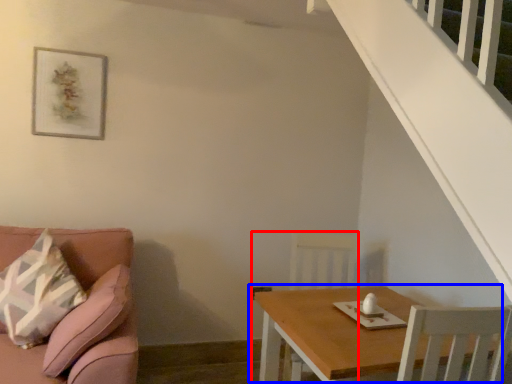
Question: Which object is closer to the camera taking this photo, armchair (highlighted by a red box) or table (highlighted by a blue box)?

Choices:
 (A) armchair
 (B) table

Answer: (B)